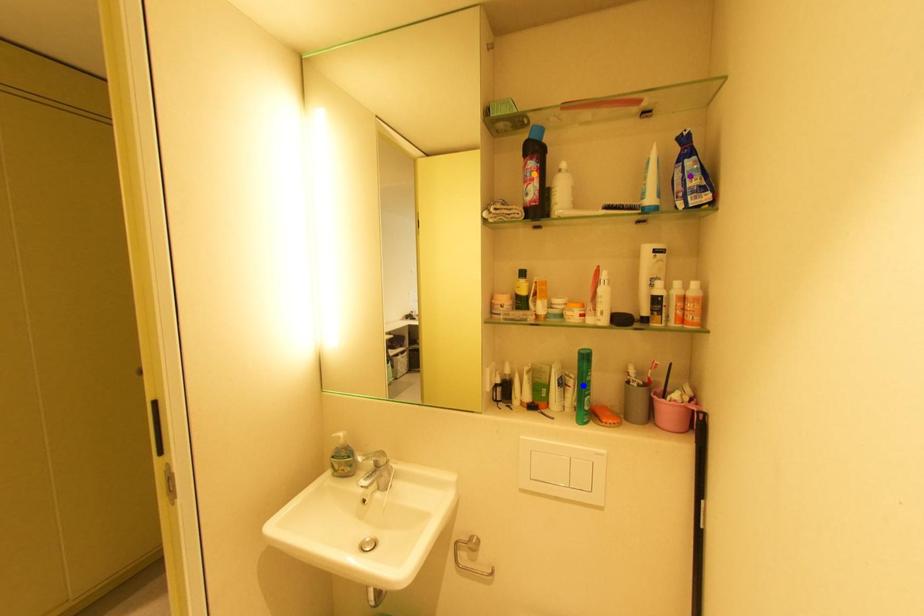
Order these from nearest to farthest:
orange point
blue point
purple point

purple point < orange point < blue point